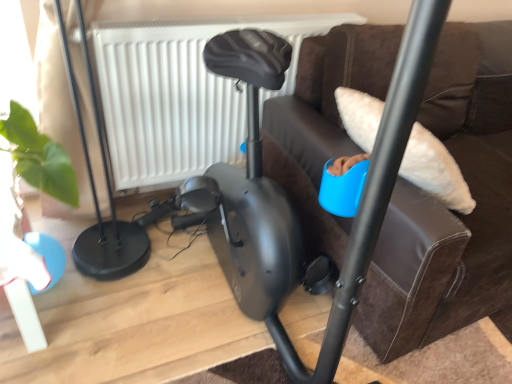
Locate an element on the screen. The height and width of the screenshot is (384, 512). empty space that is ontop of white textured radiator at upper center (from a real-world perspective) is located at coordinates (221, 8).